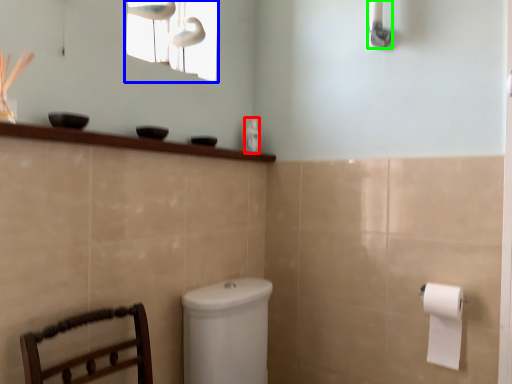
Question: Based on their relative distances, which object is farther from toiletry (highlighted by a red box)? Choose from window screen (highlighted by a blue box) and shower (highlighted by a green box).

Choices:
 (A) window screen
 (B) shower

Answer: (B)